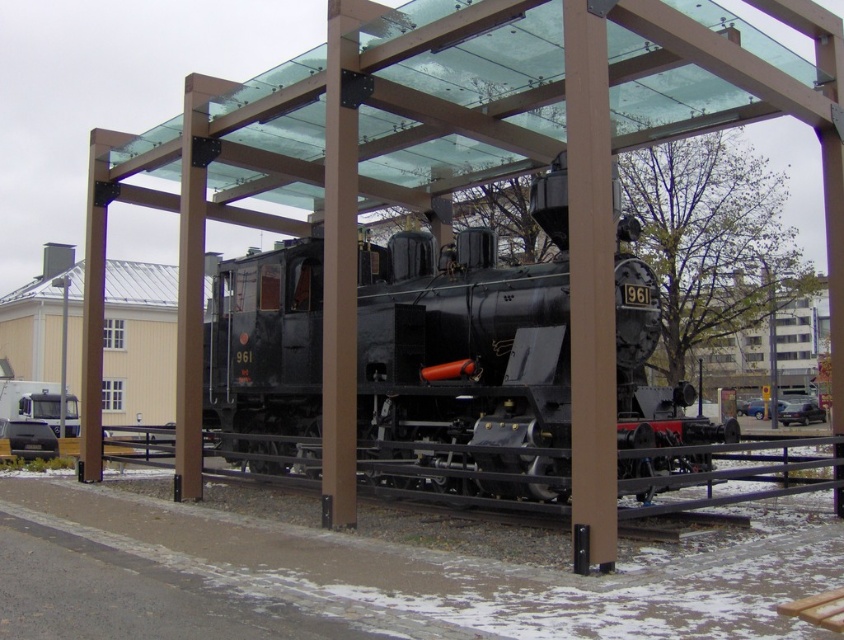
Looking at this image, you are a maintenance worker needing to inspect both the matte black locomotive at center and the black metal rail at center. Your inspection tool has a maximum reach of 2 meters. Can you inspect both objects without moving your position?

The matte black locomotive at center and the black metal rail at center are 2.11 meters apart from each other. Since your tool only reaches 2 meters, you cannot inspect both without moving your position because the distance between them exceeds the tool reach.

You are a visitor at a railway museum and want to take a photo of the matte black locomotive at center. Since the black metal rail at center is blocking the view, can you move it out of the way?

The matte black locomotive at center has a smaller size compared to black metal rail at center, so the black metal rail at center is larger and likely part of the exhibit structure. Moving it might be difficult or not allowed, so find another angle instead.